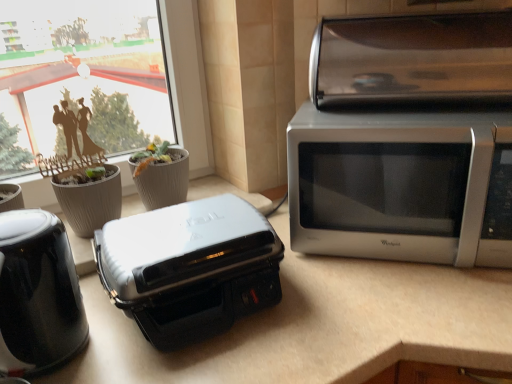
Find the location of a particular element. satin silver microwave at right is located at coordinates (402, 186).

Describe the element at coordinates (412, 58) in the screenshot. This screenshot has height=384, width=512. I see `satin silver toaster oven at upper right` at that location.

Where is `black glossy kettle at left`? The image size is (512, 384). black glossy kettle at left is located at coordinates (38, 293).

What is the approximate width of white glossy countertop at center?

The width of white glossy countertop at center is 24.77 inches.

Find the location of `gray textured flowerpot at center, placed as the 2th flowerpot when sorted from left to right`. gray textured flowerpot at center, placed as the 2th flowerpot when sorted from left to right is located at coordinates (162, 179).

Does gray textured flowerpot at left, which is the first flowerpot from left to right, have a lesser width compared to black glossy kettle at left?

Yes.

Could you tell me if gray textured flowerpot at left, acting as the 2th flowerpot starting from the right, is facing black glossy kettle at left?

Yes.

Considering their positions, is gray textured flowerpot at left, acting as the 2th flowerpot starting from the right, located in front of or behind black glossy kettle at left?

In the image, gray textured flowerpot at left, acting as the 2th flowerpot starting from the right, appears behind black glossy kettle at left.

How many degrees apart are the facing directions of gray textured flowerpot at center, placed as the 2th flowerpot when sorted from left to right, and black glossy kettle at left?

The angle between the facing direction of gray textured flowerpot at center, placed as the 2th flowerpot when sorted from left to right, and the facing direction of black glossy kettle at left is 0.558 degrees.

Could you measure the distance between gray textured flowerpot at center, which is the first flowerpot in right-to-left order, and black glossy kettle at left?

16.62 inches.

Is gray textured flowerpot at center, placed as the 2th flowerpot when sorted from left to right, situated inside black glossy kettle at left or outside?

gray textured flowerpot at center, placed as the 2th flowerpot when sorted from left to right, exists outside the volume of black glossy kettle at left.

Between gray textured flowerpot at center, placed as the 2th flowerpot when sorted from left to right, and black glossy kettle at left, which one has less height?

gray textured flowerpot at center, placed as the 2th flowerpot when sorted from left to right, is shorter.

How distant is gray textured flowerpot at center, placed as the 2th flowerpot when sorted from left to right, from white plastic toaster at center?

gray textured flowerpot at center, placed as the 2th flowerpot when sorted from left to right, and white plastic toaster at center are 13.12 inches apart from each other.

From their relative heights in the image, would you say gray textured flowerpot at center, placed as the 2th flowerpot when sorted from left to right, is taller or shorter than white plastic toaster at center?

In the image, gray textured flowerpot at center, placed as the 2th flowerpot when sorted from left to right, appears to be shorter than white plastic toaster at center.

Which is further, (151, 206) or (145, 213)?

The point (151, 206) is farther from the camera.

Considering the sizes of black glossy kettle at left and gray textured flowerpot at center, which is the first flowerpot in right-to-left order, in the image, is black glossy kettle at left bigger or smaller than gray textured flowerpot at center, which is the first flowerpot in right-to-left order,?

Clearly, black glossy kettle at left is larger in size than gray textured flowerpot at center, which is the first flowerpot in right-to-left order.

Where is `the 2nd flowerpot behind the black glossy kettle at left, starting your count from the anchor`? The width and height of the screenshot is (512, 384). the 2nd flowerpot behind the black glossy kettle at left, starting your count from the anchor is located at coordinates (162, 179).

Considering the sizes of objects black glossy kettle at left and gray textured flowerpot at center, placed as the 2th flowerpot when sorted from left to right, in the image provided, who is wider, black glossy kettle at left or gray textured flowerpot at center, placed as the 2th flowerpot when sorted from left to right,?

Wider between the two is black glossy kettle at left.

Is black glossy kettle at left behind gray textured flowerpot at center, which is the first flowerpot in right-to-left order?

No, black glossy kettle at left is closer to the camera.

Do you think white plastic toaster at center is within black glossy kettle at left, or outside of it?

white plastic toaster at center is outside black glossy kettle at left.

Is white plastic toaster at center placed right next to black glossy kettle at left?

There is a gap between white plastic toaster at center and black glossy kettle at left.

Is white plastic toaster at center aimed at black glossy kettle at left?

No, white plastic toaster at center is not facing towards black glossy kettle at left.

Does point (98, 261) come closer to viewer compared to point (2, 356)?

No, (98, 261) is behind (2, 356).

Which is closer to the camera, [329,208] or [96,201]?

Point [329,208] is positioned closer to the camera compared to point [96,201].

What's the angular difference between satin silver microwave at right and gray textured flowerpot at left, acting as the 2th flowerpot starting from the right,'s facing directions?

There is a 44.5-degree angle between the facing directions of satin silver microwave at right and gray textured flowerpot at left, acting as the 2th flowerpot starting from the right.

I want to click on the 2nd flowerpot below the satin silver microwave at right (from a real-world perspective), so click(x=91, y=202).

Which object is further away from the camera, satin silver microwave at right or gray textured flowerpot at left, which is the first flowerpot from left to right?

gray textured flowerpot at left, which is the first flowerpot from left to right, is behind.

Would you consider black glossy kettle at left to be distant from satin silver toaster oven at upper right?

No, black glossy kettle at left is in close proximity to satin silver toaster oven at upper right.

Is black glossy kettle at left surrounding satin silver toaster oven at upper right?

Definitely not — satin silver toaster oven at upper right is not inside black glossy kettle at left.

From a real-world perspective, is black glossy kettle at left above or below satin silver toaster oven at upper right?

Clearly, from a real-world perspective, black glossy kettle at left is below satin silver toaster oven at upper right.

Identify the location of home appliance above the gray textured flowerpot at left, which is the first flowerpot from left to right (from a real-world perspective). (38, 293).

Identify the location of home appliance below the gray textured flowerpot at center, which is the first flowerpot in right-to-left order (from the image's perspective). 38,293.

Looking at the image, which one is located further to satin silver toaster oven at upper right, white plastic toaster at center or satin silver microwave at right?

Based on the image, white plastic toaster at center appears to be further to satin silver toaster oven at upper right.

Which object lies further to the anchor point satin silver toaster oven at upper right, gray textured flowerpot at center, placed as the 2th flowerpot when sorted from left to right, or black glossy kettle at left?

black glossy kettle at left is further to satin silver toaster oven at upper right.

From the image, which object appears to be nearer to black glossy kettle at left, white glossy countertop at center or satin silver microwave at right?

The object closer to black glossy kettle at left is white glossy countertop at center.

Consider the image. Estimate the real-world distances between objects in this image. Which object is further from white glossy countertop at center, satin silver toaster oven at upper right or white plastic toaster at center?

Among the two, satin silver toaster oven at upper right is located further to white glossy countertop at center.

From the image, which object appears to be farther from gray textured flowerpot at center, which is the first flowerpot in right-to-left order, white plastic toaster at center or gray textured flowerpot at left, which is the first flowerpot from left to right?

Among the two, white plastic toaster at center is located further to gray textured flowerpot at center, which is the first flowerpot in right-to-left order.

From the image, which object appears to be farther from gray textured flowerpot at center, which is the first flowerpot in right-to-left order, gray textured flowerpot at left, which is the first flowerpot from left to right, or satin silver microwave at right?

satin silver microwave at right.

Based on their spatial positions, is white plastic toaster at center or gray textured flowerpot at center, placed as the 2th flowerpot when sorted from left to right, further from gray textured flowerpot at left, acting as the 2th flowerpot starting from the right?

white plastic toaster at center is further to gray textured flowerpot at left, acting as the 2th flowerpot starting from the right.

Considering their positions, is black glossy kettle at left positioned closer to gray textured flowerpot at left, which is the first flowerpot from left to right, than satin silver toaster oven at upper right?

black glossy kettle at left lies closer to gray textured flowerpot at left, which is the first flowerpot from left to right, than the other object.

Where is `microwave oven between gray textured flowerpot at left, which is the first flowerpot from left to right, and satin silver toaster oven at upper right from left to right`? The height and width of the screenshot is (384, 512). microwave oven between gray textured flowerpot at left, which is the first flowerpot from left to right, and satin silver toaster oven at upper right from left to right is located at coordinates (402, 186).

Identify the location of home appliance located between gray textured flowerpot at left, acting as the 2th flowerpot starting from the right, and satin silver microwave at right in the left-right direction. This screenshot has width=512, height=384. (38, 293).

You are a GUI agent. You are given a task and a screenshot of the screen. Output one action in this format:
    pyautogui.click(x=<x>, y=<y>)
    Task: Click on the microwave oven between black glossy kettle at left and satin silver toaster oven at upper right from left to right
    Image resolution: width=512 pixels, height=384 pixels.
    Given the screenshot: What is the action you would take?
    pyautogui.click(x=402, y=186)

Image resolution: width=512 pixels, height=384 pixels. I want to click on flowerpot situated between black glossy kettle at left and satin silver toaster oven at upper right from left to right, so click(162, 179).